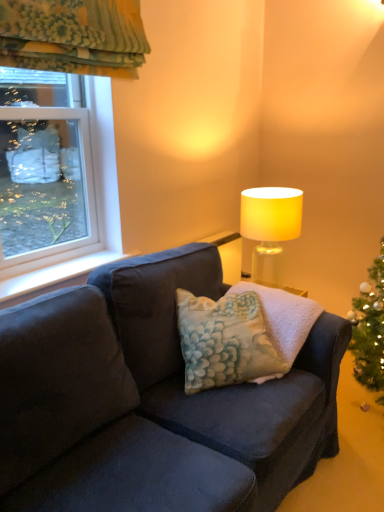
Question: Considering the positions of matte yellow lampshade at upper right and clear glass window at upper left in the image, is matte yellow lampshade at upper right bigger or smaller than clear glass window at upper left?

Choices:
 (A) big
 (B) small

Answer: (A)

Question: Is point (266, 193) closer or farther from the camera than point (114, 217)?

Choices:
 (A) closer
 (B) farther

Answer: (B)

Question: Considering the real-world distances, which object is farthest from the clear glass window at upper left?

Choices:
 (A) fluffy fabric pillow at center
 (B) matte yellow lampshade at upper right
 (C) white smooth window sill at left

Answer: (B)

Question: Which of these objects is positioned farthest from the matte yellow lampshade at upper right?

Choices:
 (A) clear glass window at upper left
 (B) white smooth window sill at left
 (C) fluffy fabric pillow at center

Answer: (A)